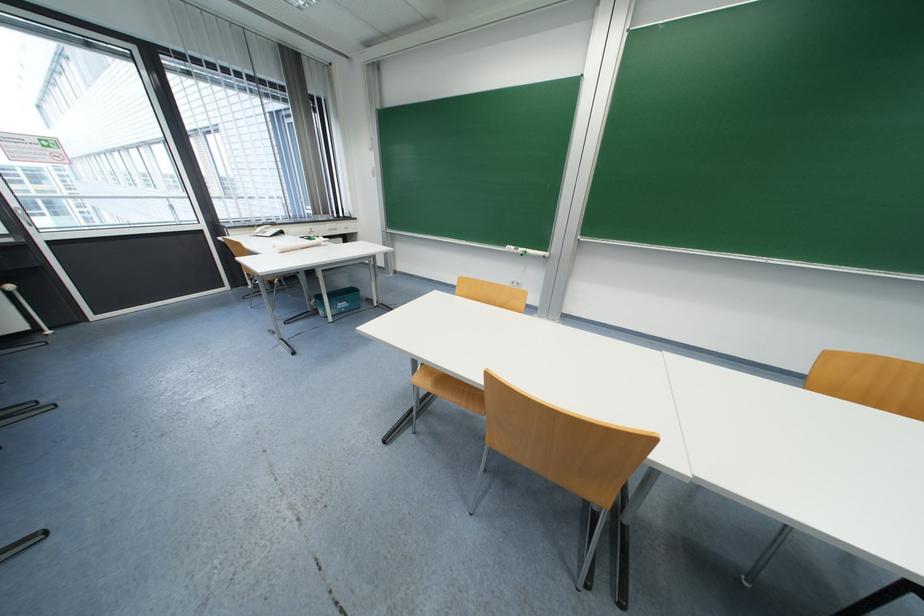
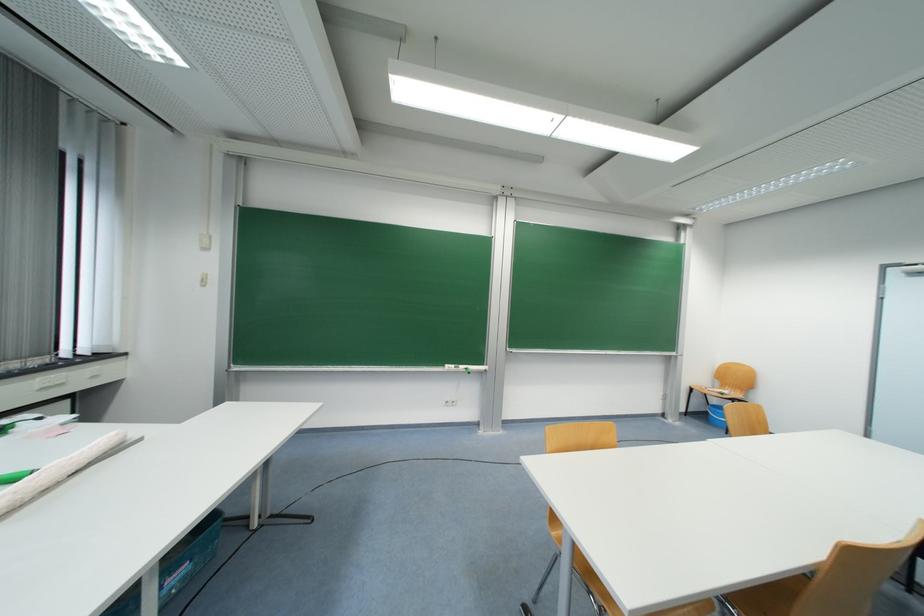
In the second image, find the point that corresponds to point 520,286 in the first image.

(455, 406)